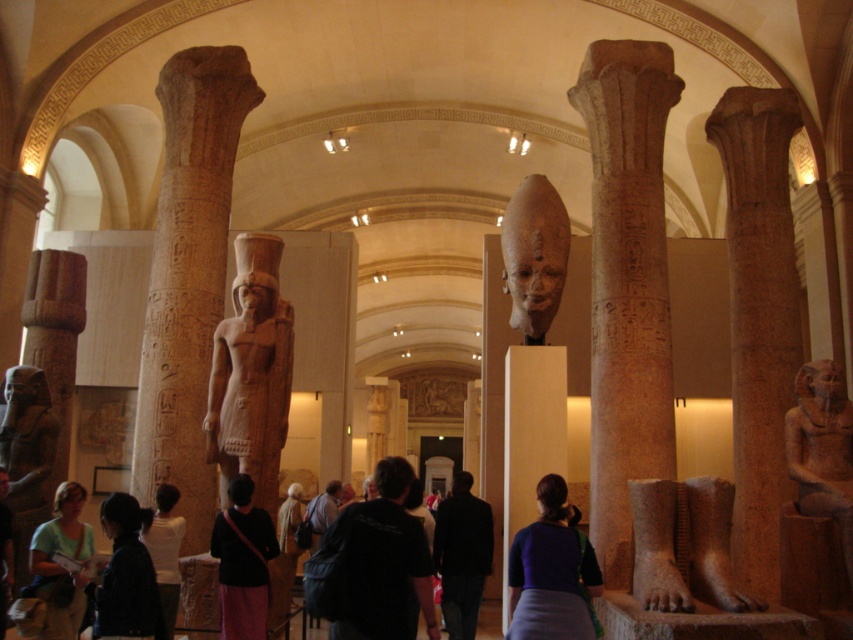
You are an art student visiting the museum and want to sketch the brown stone column at left and the beige stone statue at center. Which object should you focus on first if you want to draw the larger one?

The brown stone column at left is larger in size than the beige stone statue at center, so you should focus on drawing the brown stone column at left first.

You are an interior designer planning to place a new exhibit between the brown stone column at left and the beige stone statue at center. Which object is wider so that the exhibit can be placed closer to it?

The brown stone column at left is wider than the beige stone statue at center, so the exhibit should be placed closer to the brown stone column at left.

You are an archaeologist examining the ancient Egyptian gallery. You see the brown stone column at left and the beige stone statue at center. Which object is located to the left of the other?

The brown stone column at left is positioned on the left side of beige stone statue at center.